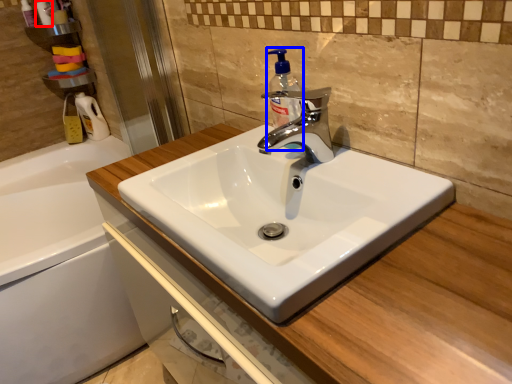
Question: Which object appears closest to the camera in this image, toiletry (highlighted by a red box) or soap dispenser (highlighted by a blue box)?

Choices:
 (A) toiletry
 (B) soap dispenser

Answer: (B)